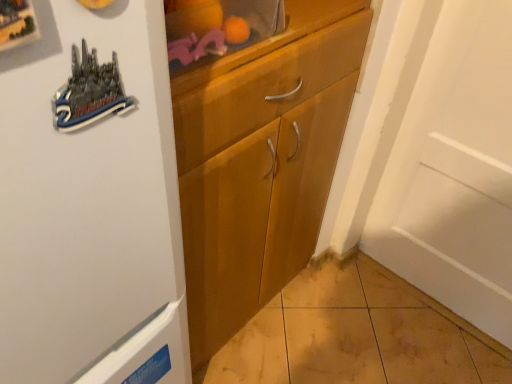
Question: Is point (192, 228) closer or farther from the camera than point (244, 19)?

Choices:
 (A) farther
 (B) closer

Answer: (A)

Question: Relative to wooden cabinet at upper center, is wooden cabinet at center in front or behind?

Choices:
 (A) front
 (B) behind

Answer: (B)

Question: Is wooden cabinet at center taller or shorter than wooden cabinet at upper center?

Choices:
 (A) tall
 (B) short

Answer: (A)

Question: In the image, is wooden cabinet at upper center positioned in front of or behind wooden cabinet at center?

Choices:
 (A) behind
 (B) front

Answer: (B)

Question: Considering the positions of point (192, 62) and point (350, 34), is point (192, 62) closer or farther from the camera than point (350, 34)?

Choices:
 (A) closer
 (B) farther

Answer: (A)

Question: From the image's perspective, is wooden cabinet at upper center located above or below wooden cabinet at center?

Choices:
 (A) below
 (B) above

Answer: (B)

Question: Based on their positions, is wooden cabinet at upper center located to the left or right of wooden cabinet at center?

Choices:
 (A) left
 (B) right

Answer: (B)